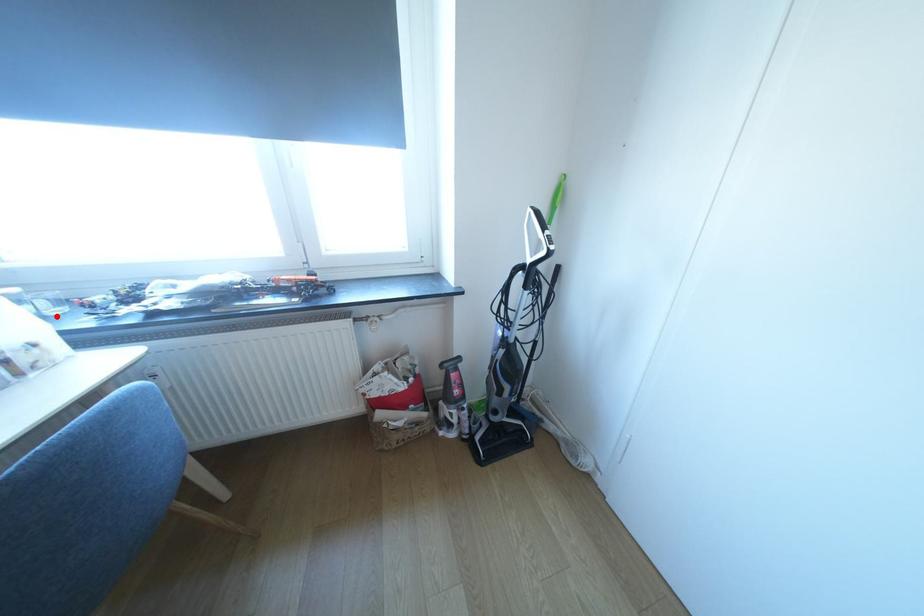
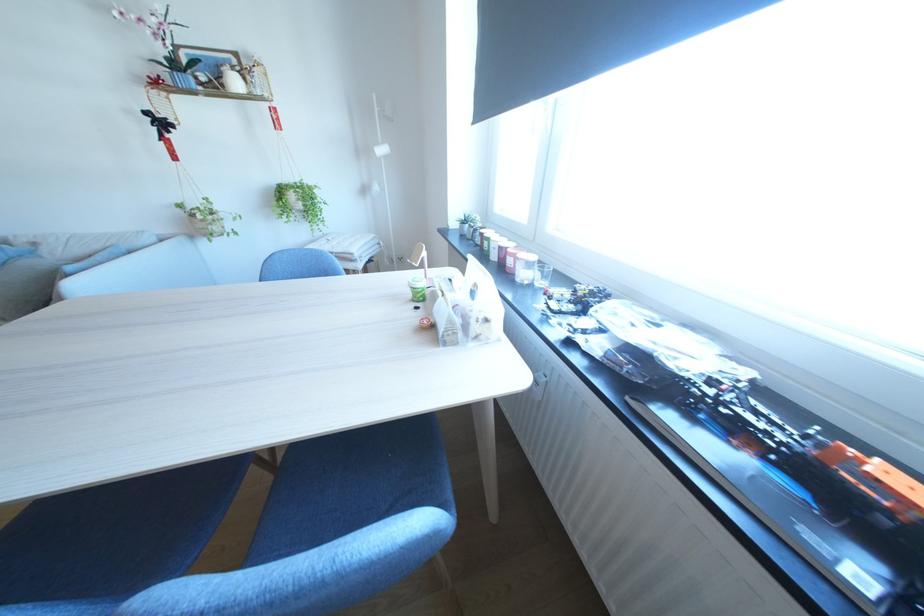
In the second image, find the point that corresponds to the highlighted location in the first image.

(545, 285)